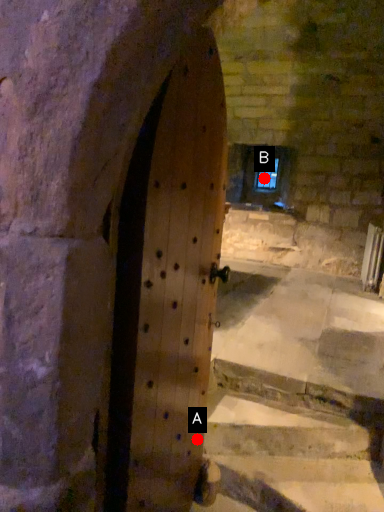
Question: Two points are circled on the image, labeled by A and B beside each circle. Which point is closer to the camera?

Choices:
 (A) A is closer
 (B) B is closer

Answer: (A)